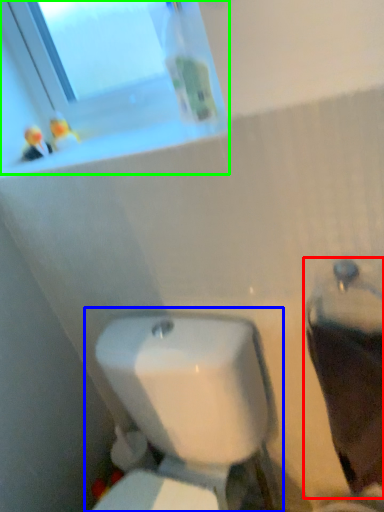
Question: Which is nearer to the porcelain (highlighted by a red box)? toilet (highlighted by a blue box) or window (highlighted by a green box).

Choices:
 (A) toilet
 (B) window

Answer: (A)